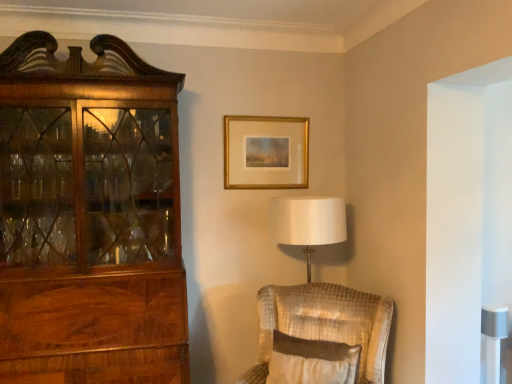
Question: Should I look upward or downward to see gold metallic picture frame at upper center?

Choices:
 (A) up
 (B) down

Answer: (A)

Question: Would you say white textured pillow at center is part of gold metallic picture frame at upper center's contents?

Choices:
 (A) no
 (B) yes

Answer: (A)

Question: Considering the relative positions of gold metallic picture frame at upper center and white textured pillow at center in the image provided, is gold metallic picture frame at upper center to the left of white textured pillow at center from the viewer's perspective?

Choices:
 (A) no
 (B) yes

Answer: (B)

Question: Considering the relative sizes of gold metallic picture frame at upper center and white textured pillow at center in the image provided, is gold metallic picture frame at upper center thinner than white textured pillow at center?

Choices:
 (A) no
 (B) yes

Answer: (B)

Question: Is gold metallic picture frame at upper center positioned behind white textured pillow at center?

Choices:
 (A) no
 (B) yes

Answer: (B)

Question: Is gold metallic picture frame at upper center far from white textured pillow at center?

Choices:
 (A) no
 (B) yes

Answer: (B)

Question: Considering the relative positions of gold metallic picture frame at upper center and white textured pillow at center in the image provided, is gold metallic picture frame at upper center to the right of white textured pillow at center from the viewer's perspective?

Choices:
 (A) yes
 (B) no

Answer: (B)

Question: Is velvet beige chair at lower right facing away from white textured pillow at center?

Choices:
 (A) no
 (B) yes

Answer: (B)

Question: Considering the relative positions of velvet beige chair at lower right and white textured pillow at center in the image provided, is velvet beige chair at lower right in front of white textured pillow at center?

Choices:
 (A) no
 (B) yes

Answer: (A)

Question: Does velvet beige chair at lower right have a larger size compared to white textured pillow at center?

Choices:
 (A) yes
 (B) no

Answer: (A)

Question: From a real-world perspective, is velvet beige chair at lower right physically above white textured pillow at center?

Choices:
 (A) yes
 (B) no

Answer: (B)

Question: Considering the relative sizes of velvet beige chair at lower right and white textured pillow at center in the image provided, is velvet beige chair at lower right thinner than white textured pillow at center?

Choices:
 (A) no
 (B) yes

Answer: (A)

Question: Considering the relative positions of velvet beige chair at lower right and white textured pillow at center in the image provided, is velvet beige chair at lower right to the left of white textured pillow at center from the viewer's perspective?

Choices:
 (A) yes
 (B) no

Answer: (B)

Question: Can you confirm if white textured pillow at center is taller than velvet beige chair at lower right?

Choices:
 (A) no
 (B) yes

Answer: (A)